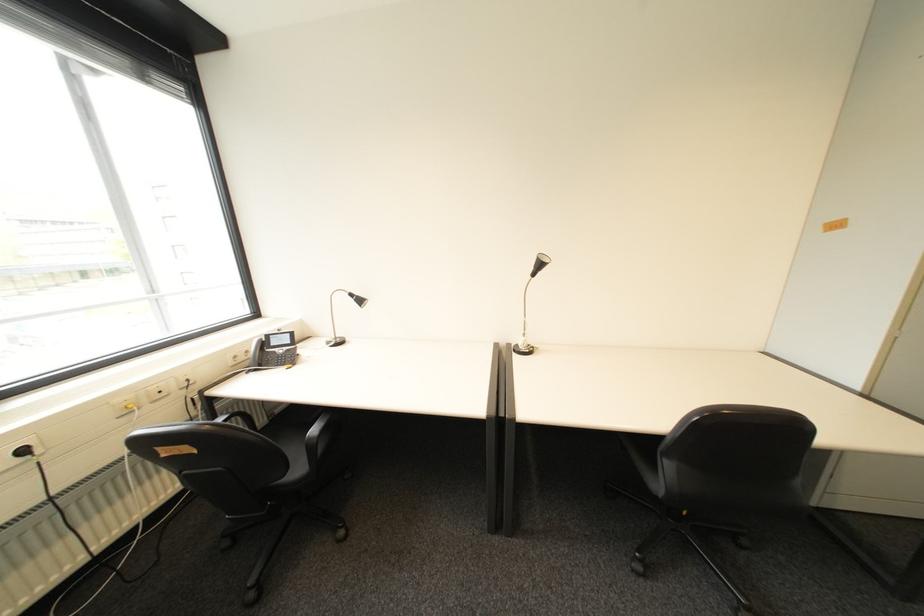
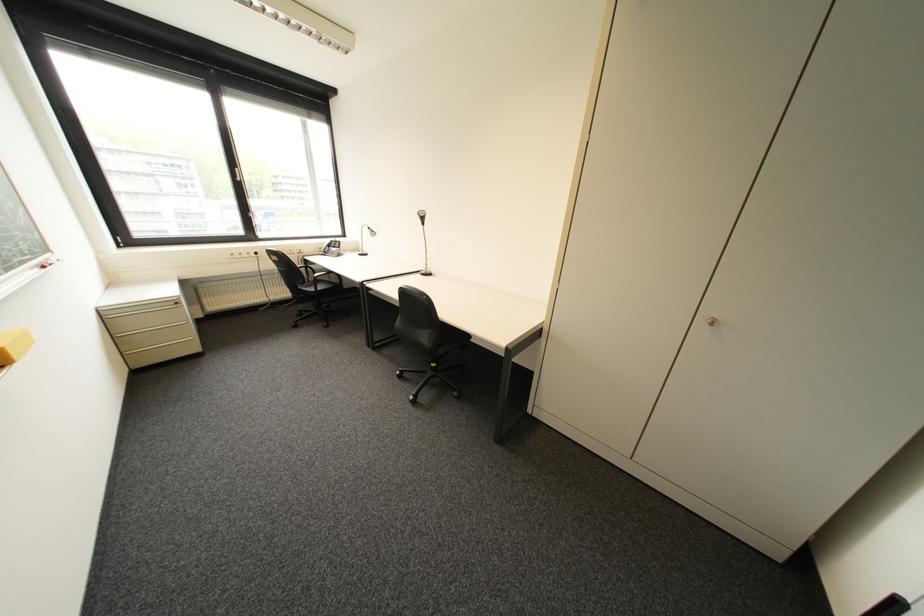
In the second image, find the point that corresponds to point 237,544 in the first image.

(309, 314)